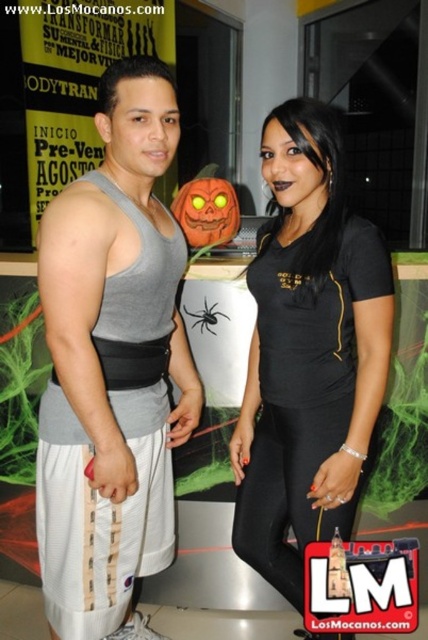
The image size is (428, 640). What are the coordinates of `black matte shirt at center` in the screenshot? It's located at (308, 352).

Is black matte shirt at center below black matte spider at center?

Yes.

Where is `black matte shirt at center`? black matte shirt at center is located at coordinates (308, 352).

The height and width of the screenshot is (640, 428). Identify the location of black matte shirt at center. (308, 352).

Is gray fabric tank top at center wider than black matte spider at center?

Yes, gray fabric tank top at center is wider than black matte spider at center.

Measure the distance between gray fabric tank top at center and camera.

gray fabric tank top at center and camera are 1.18 meters apart.

Does point (47, 225) lie in front of point (211, 324)?

Yes, point (47, 225) is closer to viewer.

Where is `gray fabric tank top at center`? gray fabric tank top at center is located at coordinates (101, 362).

Can you confirm if gray fabric tank top at center is shorter than black matte shirt at center?

In fact, gray fabric tank top at center may be taller than black matte shirt at center.

Between gray fabric tank top at center and black matte shirt at center, which one has less height?

black matte shirt at center is shorter.

I want to click on gray fabric tank top at center, so click(x=101, y=362).